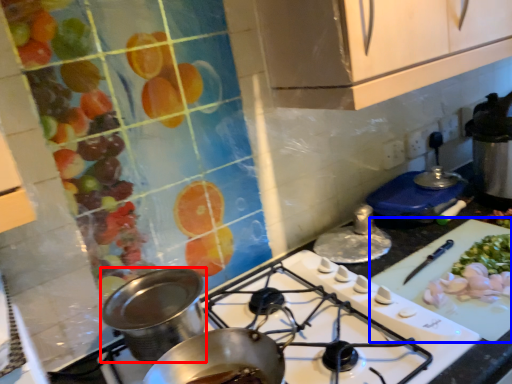
Question: Which of the following is the farthest to the observer, kitchen appliance (highlighted by a red box) or cutting board (highlighted by a blue box)?

Choices:
 (A) kitchen appliance
 (B) cutting board

Answer: (B)